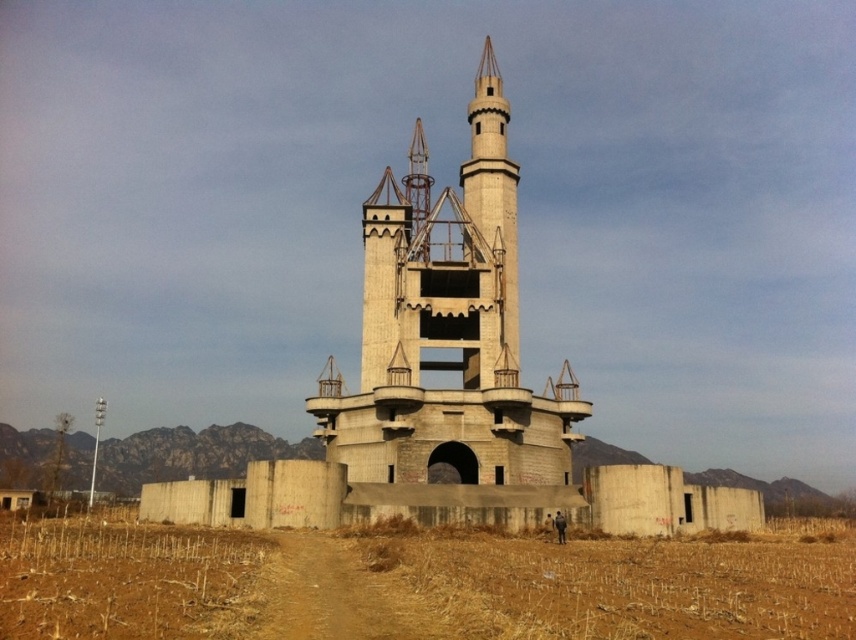
Who is positioned more to the left, brown dry grass at lower center or concretecastle at center?

From the viewer's perspective, brown dry grass at lower center appears more on the left side.

Which is behind, point (750, 577) or point (424, 230)?

The point (424, 230) is more distant.

Identify the location of brown dry grass at lower center. This screenshot has width=856, height=640. (417, 582).

Who is taller, brown dry grass at lower center or brown dirt track at lower center?

brown dry grass at lower center

Between point (96, 609) and point (311, 536), which one is positioned behind?

Positioned behind is point (311, 536).

This screenshot has width=856, height=640. Describe the element at coordinates (417, 582) in the screenshot. I see `brown dry grass at lower center` at that location.

The height and width of the screenshot is (640, 856). In order to click on brown dry grass at lower center in this screenshot , I will do `click(417, 582)`.

Does brown dry grass at lower center have a lesser height compared to concrete tower at center?

Correct, brown dry grass at lower center is not as tall as concrete tower at center.

Who is taller, brown dry grass at lower center or concrete tower at center?

With more height is concrete tower at center.

Between point (777, 573) and point (373, 392), which one is positioned behind?

The point (373, 392) is behind.

Identify the location of brown dry grass at lower center. The width and height of the screenshot is (856, 640). (417, 582).